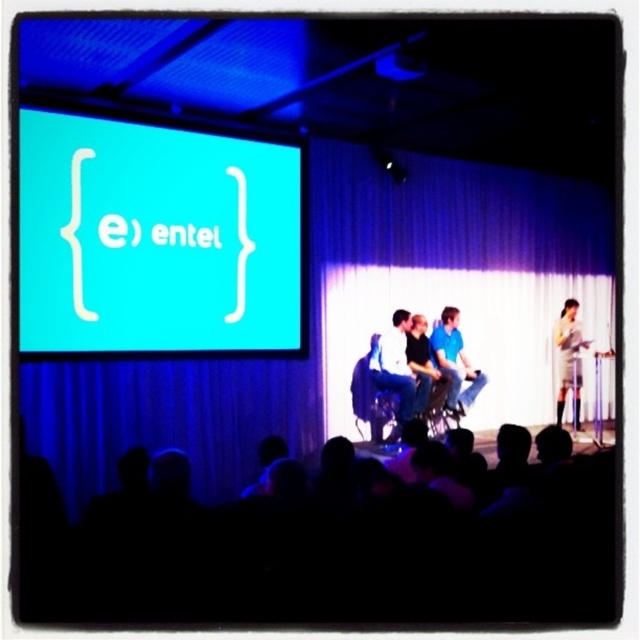
Between point (336, 250) and point (401, 394), which one is positioned behind?

The point (336, 250) is behind.

Which is behind, point (524, 420) or point (394, 342)?

The point (524, 420) is more distant.

This screenshot has height=640, width=640. What are the coordinates of `blue fabric curtain at upper center` in the screenshot? It's located at (353, 321).

Can you confirm if blue fabric curtain at upper center is wider than teal matte projection screen at upper left?

No, blue fabric curtain at upper center is not wider than teal matte projection screen at upper left.

Between blue fabric curtain at upper center and teal matte projection screen at upper left, which one appears on the left side from the viewer's perspective?

Positioned to the left is teal matte projection screen at upper left.

Who is more distant from viewer, (x=531, y=353) or (x=42, y=205)?

The point (x=531, y=353) is more distant.

Find the location of `blue fabric curtain at upper center`. blue fabric curtain at upper center is located at coordinates (353, 321).

Which is in front, point (400, 422) or point (476, 378)?

Point (400, 422)

Between point (392, 387) and point (454, 342), which one is positioned behind?

Point (454, 342)

Between point (396, 330) and point (461, 376), which one is positioned in front?

Point (396, 330)

Where is `matte white shirt at center`? This screenshot has width=640, height=640. matte white shirt at center is located at coordinates (397, 371).